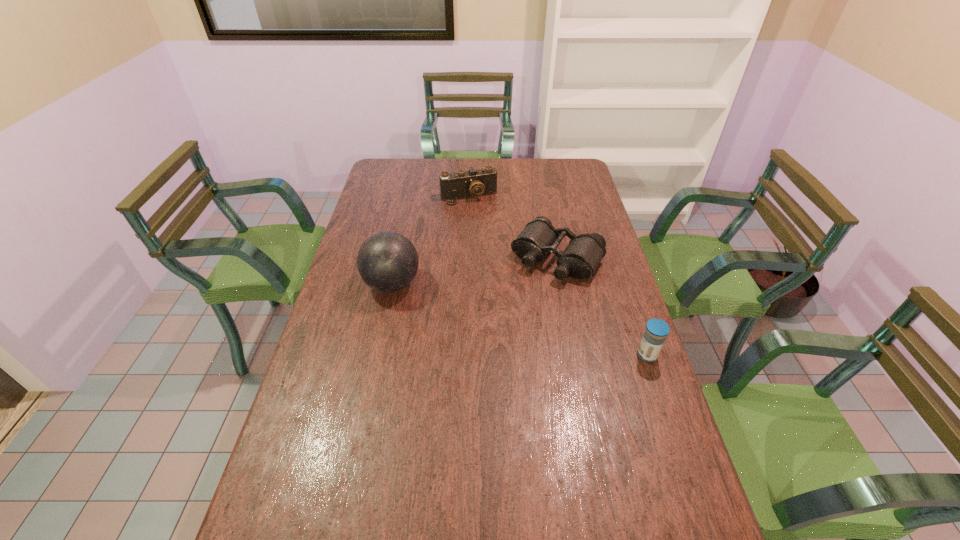
In the image, there is a desktop. Identify the location of vacant region at the far edge. (458, 165).

Where is `vacant area at the left edge of the desktop`? The width and height of the screenshot is (960, 540). vacant area at the left edge of the desktop is located at coordinates (311, 369).

Find the location of a particular element. The height and width of the screenshot is (540, 960). vacant region at the right edge of the desktop is located at coordinates (582, 232).

In the image, there is a desktop. Where is `vacant space at the far left corner`? The height and width of the screenshot is (540, 960). vacant space at the far left corner is located at coordinates (392, 163).

This screenshot has height=540, width=960. In the image, there is a desktop. Find the location of `vacant space at the far right corner`. vacant space at the far right corner is located at coordinates (575, 178).

Locate an element on the screen. This screenshot has width=960, height=540. vacant space that's between the leftmost object and the binoculars is located at coordinates (474, 271).

Identify the location of vacant area that lies between the bowling ball and the rightmost object. The width and height of the screenshot is (960, 540). (519, 320).

The image size is (960, 540). What are the coordinates of `free space between the bowling ball and the rightmost object` in the screenshot? It's located at 519,320.

Image resolution: width=960 pixels, height=540 pixels. In order to click on vacant area that lies between the rightmost object and the third object from left to right in this screenshot , I will do `click(602, 306)`.

The height and width of the screenshot is (540, 960). Find the location of `free spot between the tallest object and the medicine`. free spot between the tallest object and the medicine is located at coordinates (519, 320).